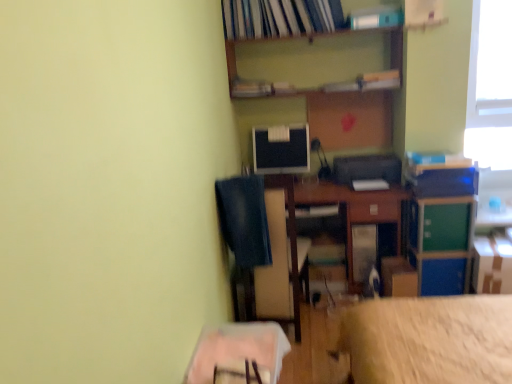
Question: Considering the relative positions of hardcover book at upper center, arranged as the first book when viewed from the top, and white plastic book at upper center, marked as the second book in a top-to-bottom arrangement, in the image provided, is hardcover book at upper center, arranged as the first book when viewed from the top, behind white plastic book at upper center, marked as the second book in a top-to-bottom arrangement,?

Choices:
 (A) yes
 (B) no

Answer: (A)

Question: Can you confirm if hardcover book at upper center, acting as the third book starting from the bottom, is smaller than white plastic book at upper center, which appears as the second book when ordered from the bottom?

Choices:
 (A) yes
 (B) no

Answer: (B)

Question: Is white plastic book at upper center, marked as the second book in a top-to-bottom arrangement, completely or partially inside hardcover book at upper center, acting as the third book starting from the bottom?

Choices:
 (A) no
 (B) yes

Answer: (A)

Question: Is hardcover book at upper center, arranged as the first book when viewed from the top, facing away from white plastic book at upper center, marked as the second book in a top-to-bottom arrangement?

Choices:
 (A) yes
 (B) no

Answer: (B)

Question: Is hardcover book at upper center, acting as the third book starting from the bottom, located outside white plastic book at upper center, which appears as the second book when ordered from the bottom?

Choices:
 (A) yes
 (B) no

Answer: (A)

Question: Is hardcover book at upper center, acting as the third book starting from the bottom, to the left of white plastic book at upper center, marked as the second book in a top-to-bottom arrangement, from the viewer's perspective?

Choices:
 (A) no
 (B) yes

Answer: (B)

Question: Can you confirm if wooden table at lower center, which is the 2th table in right-to-left order, is smaller than cardboard box at lower right, which is counted as the 1th cardboard box, starting from the left?

Choices:
 (A) yes
 (B) no

Answer: (B)

Question: From the image's perspective, is wooden table at lower center, which is the second table in back-to-front order, on top of cardboard box at lower right, which is counted as the 1th cardboard box, starting from the left?

Choices:
 (A) no
 (B) yes

Answer: (A)

Question: Can you confirm if wooden table at lower center, which is the second table in back-to-front order, is taller than cardboard box at lower right, arranged as the second cardboard box when viewed from the right?

Choices:
 (A) no
 (B) yes

Answer: (A)

Question: Is wooden table at lower center, marked as the 1th table in a left-to-right arrangement, turned away from cardboard box at lower right, which is counted as the 1th cardboard box, starting from the left?

Choices:
 (A) no
 (B) yes

Answer: (A)

Question: Does wooden table at lower center, which is the second table in back-to-front order, lie in front of cardboard box at lower right, which is counted as the 1th cardboard box, starting from the left?

Choices:
 (A) no
 (B) yes

Answer: (B)

Question: Can you confirm if wooden table at lower center, marked as the 1th table in a left-to-right arrangement, is wider than cardboard box at lower right, which is counted as the 1th cardboard box, starting from the left?

Choices:
 (A) yes
 (B) no

Answer: (A)

Question: From a real-world perspective, does white plastic book at upper center, which appears as the second book when ordered from the bottom, sit lower than wooden table at lower center, arranged as the first table when viewed from the front?

Choices:
 (A) no
 (B) yes

Answer: (A)